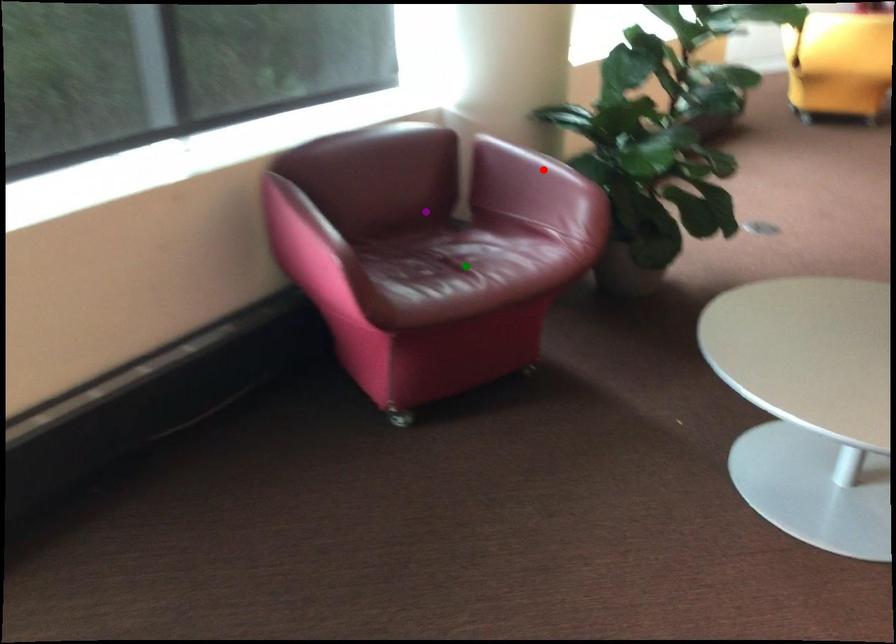
Order these from nearest to farthest:
red point | purple point | green point

green point → red point → purple point